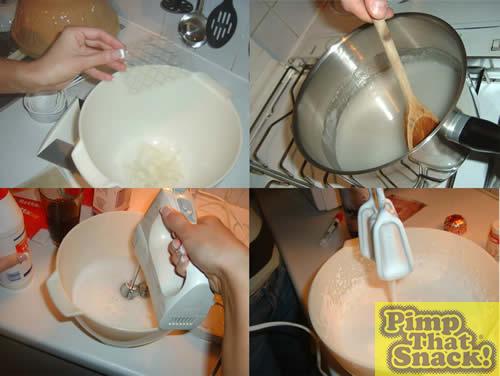
You are a GUI agent. You are given a task and a screenshot of the screen. Output one action in this format:
    pyautogui.click(x=<x>, y=<y>)
    Task: Click on the mixer
    The width and height of the screenshot is (500, 376).
    Given the screenshot: What is the action you would take?
    (163, 277)